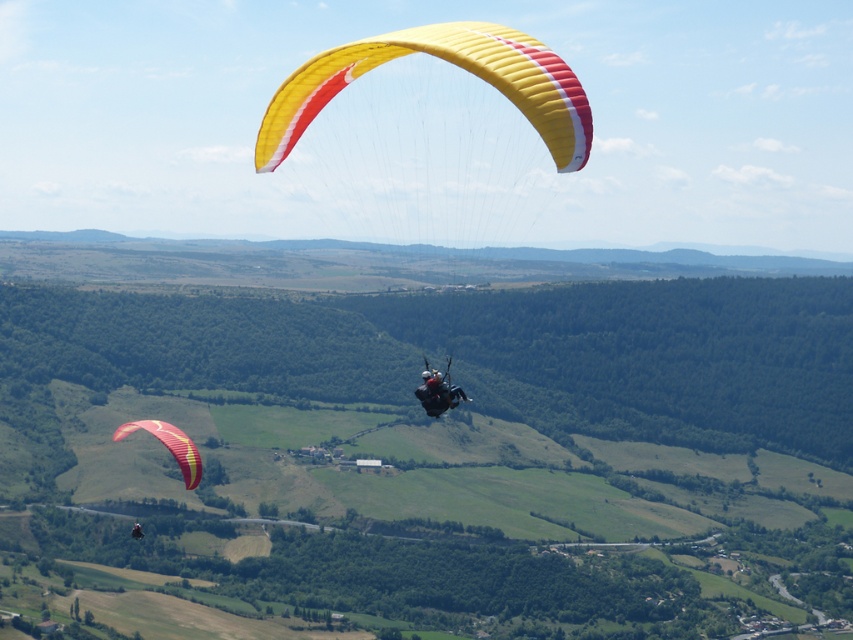
Who is higher up, yellow fabric parachute at center or yellow fabric parachute at lower left?

yellow fabric parachute at center

Is point (502, 54) closer to viewer compared to point (189, 438)?

Yes, it is in front of point (189, 438).

Where is `yellow fabric parachute at center`? This screenshot has width=853, height=640. yellow fabric parachute at center is located at coordinates (450, 61).

I want to click on yellow fabric parachute at center, so click(450, 61).

Who is more distant from viewer, (556,136) or (134,522)?

The point (134,522) is behind.

Where is `yellow fabric parachute at center`? yellow fabric parachute at center is located at coordinates (450, 61).

How distant is yellow fabric parachute at lower left from black fabric paraglider at upper center?

yellow fabric parachute at lower left and black fabric paraglider at upper center are 28.17 meters apart.

Does yellow fabric parachute at lower left have a lesser height compared to black fabric paraglider at upper center?

Yes, yellow fabric parachute at lower left is shorter than black fabric paraglider at upper center.

The width and height of the screenshot is (853, 640). What do you see at coordinates (169, 445) in the screenshot?
I see `yellow fabric parachute at lower left` at bounding box center [169, 445].

I want to click on yellow fabric parachute at lower left, so click(169, 445).